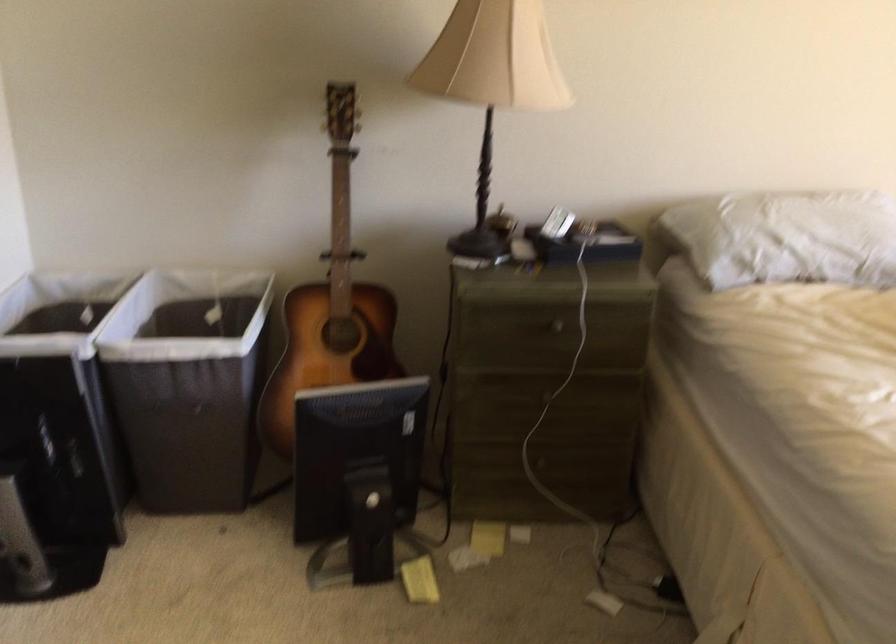
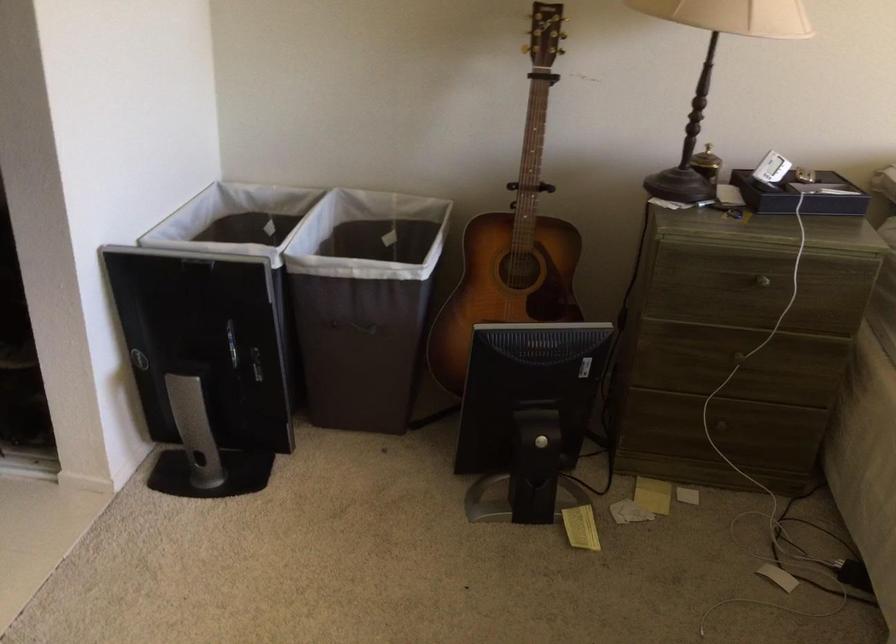
In the second image, find the point that corresponds to the point at 426,576 in the first image.

(581, 527)